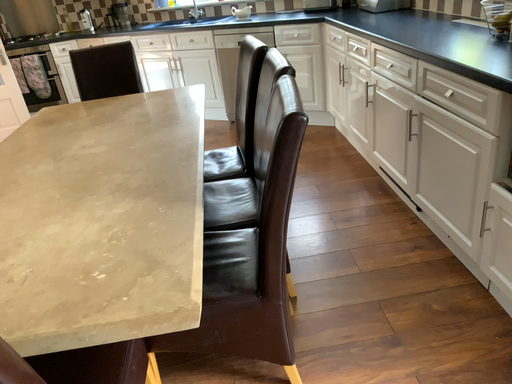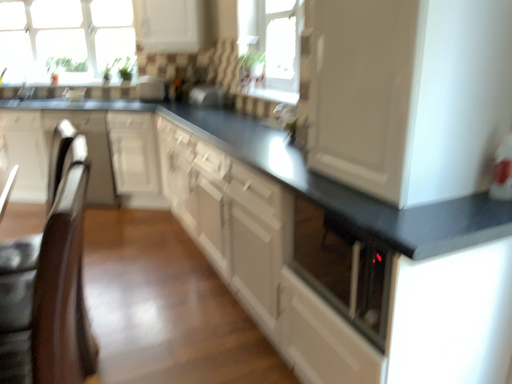
Question: Which way did the camera rotate in the video?

Choices:
 (A) rotated upward
 (B) rotated downward

Answer: (A)